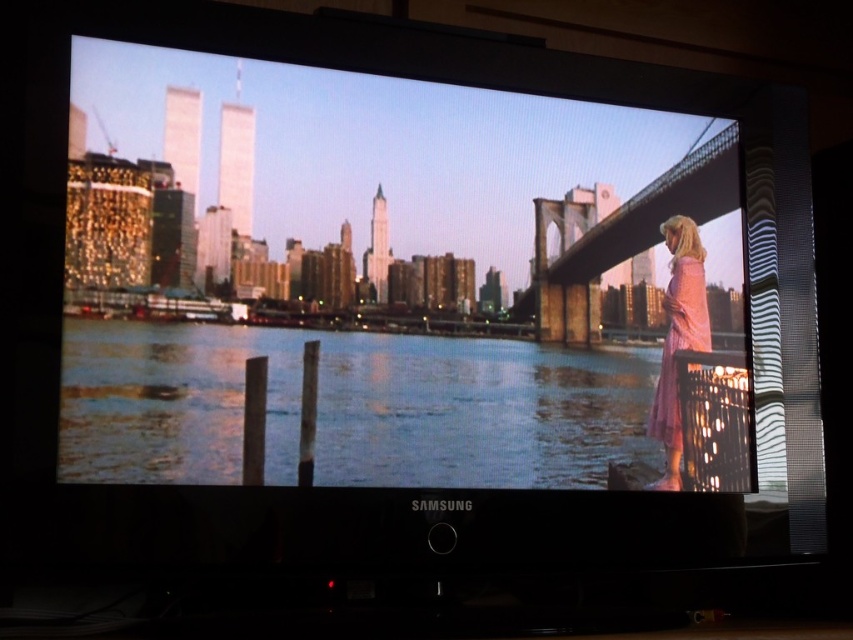
Question: Does pink fabric woman at right appear on the right side of blue reflective water at lower center?

Choices:
 (A) no
 (B) yes

Answer: (A)

Question: Does pink fabric woman at right appear under pink satin dress at right?

Choices:
 (A) no
 (B) yes

Answer: (A)

Question: Which point appears closest to the camera in this image?

Choices:
 (A) (669, 449)
 (B) (482, 305)

Answer: (B)

Question: Which object appears closest to the camera in this image?

Choices:
 (A) pink satin dress at right
 (B) blue reflective water at lower center

Answer: (B)

Question: Does pink fabric woman at right have a smaller size compared to pink satin dress at right?

Choices:
 (A) yes
 (B) no

Answer: (B)

Question: Which object is farther from the camera taking this photo?

Choices:
 (A) pink fabric woman at right
 (B) blue reflective water at lower center
 (C) pink satin dress at right

Answer: (C)